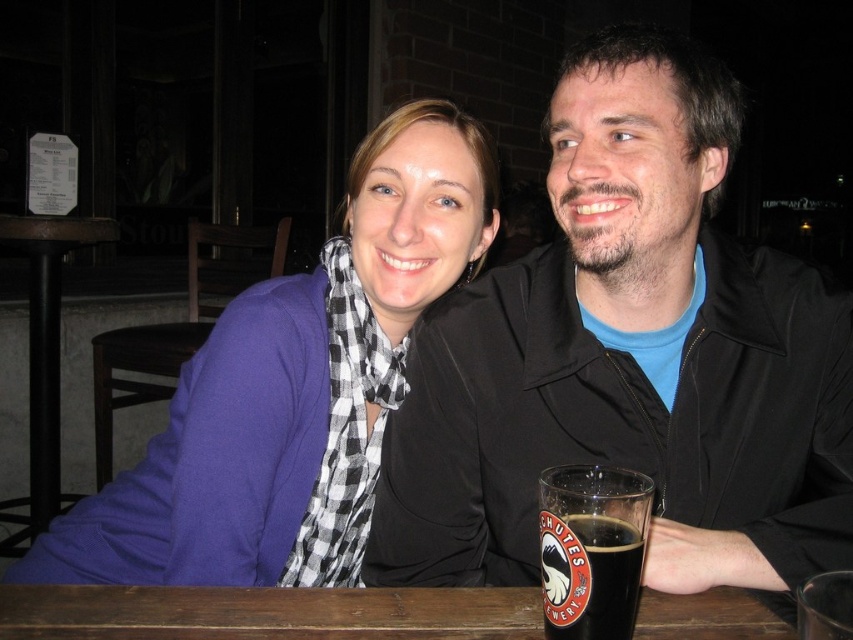
In the scene shown: Does black glass mug at lower center have a larger size compared to brown wooden table at lower left?

No.

Is point (628, 582) positioned after point (36, 346)?

No, it is in front of (36, 346).

Between point (538, 497) and point (28, 323), which one is positioned behind?

Point (28, 323)

Where is `black glass mug at lower center`? The image size is (853, 640). black glass mug at lower center is located at coordinates (590, 548).

Does point (567, 397) lie behind point (242, 305)?

That is False.

Between point (614, 436) and point (160, 508), which one is positioned in front?

Positioned in front is point (614, 436).

Where is `black matte jacket at upper right`? This screenshot has height=640, width=853. black matte jacket at upper right is located at coordinates (630, 356).

Who is positioned more to the right, brown wooden table at lower center or black glass mug at lower center?

Positioned to the right is black glass mug at lower center.

Which is above, brown wooden table at lower center or black glass mug at lower center?

black glass mug at lower center is higher up.

The width and height of the screenshot is (853, 640). I want to click on brown wooden table at lower center, so click(x=265, y=612).